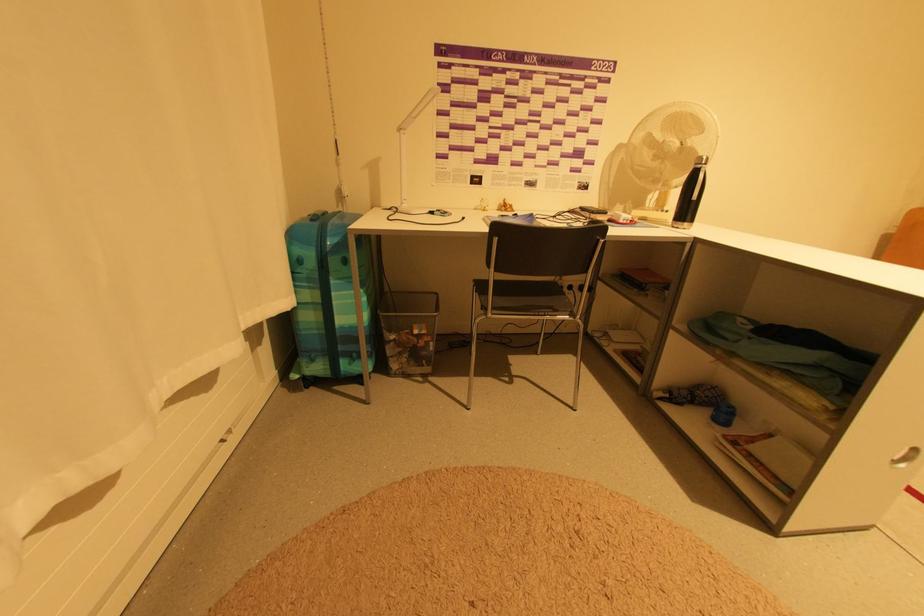
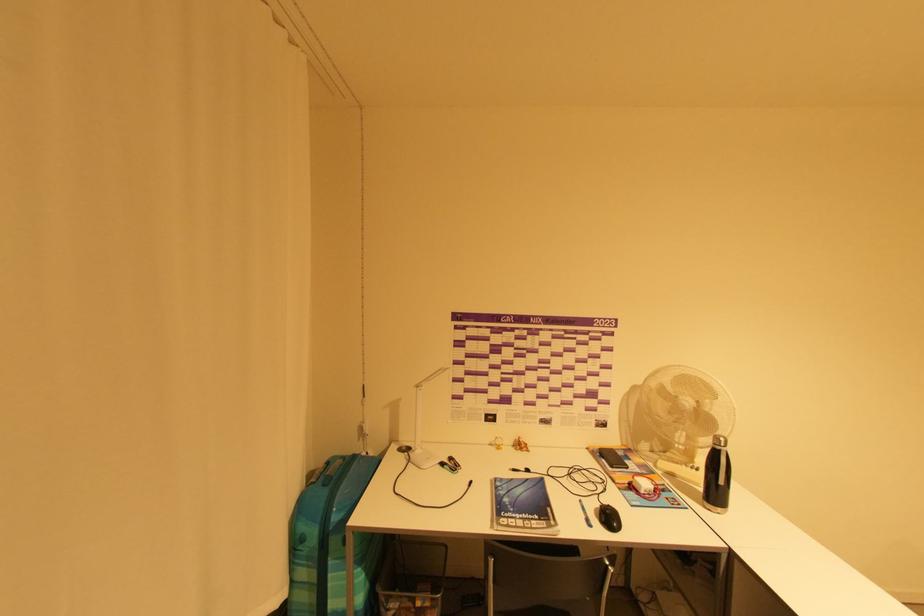
Question: How did the camera likely rotate?

Choices:
 (A) Left
 (B) Right
 (C) Up
 (D) Down

Answer: (C)